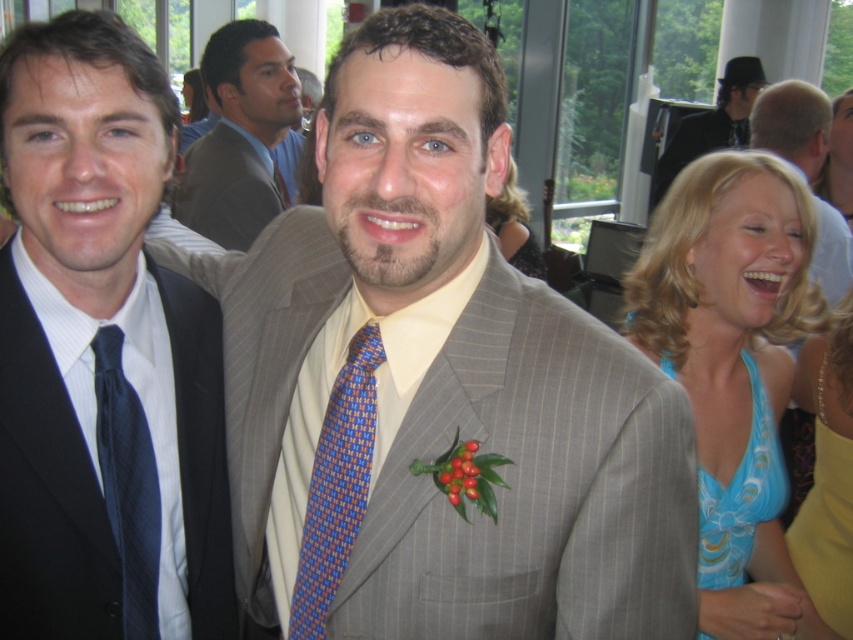
You are a photographer at a wedding reception. You need to position the light gray pinstripe suit at center and the blue silk dress at right in a photo so that both are fully visible. Given their heights, which one should you place closer to the camera to ensure both are in frame without cropping?

The light gray pinstripe suit at center is shorter than the blue silk dress at right. To ensure both are fully visible without cropping, position the shorter light gray pinstripe suit at center closer to the camera and the taller blue silk dress at right slightly farther back. This arrangement will allow the camera to capture both subjects in full without cutting off any parts of them.

You are a photographer at the event and need to adjust your camera settings to capture the blue floral dress at right clearly. Considering the dress is 1.45 meters away from the camera, what is the minimum focusing distance your camera should have to ensure sharpness?

The blue floral dress at right is 1.45 meters away from the camera. To capture it clearly, the camera must have a minimum focusing distance of at least 1.45 meters or less.